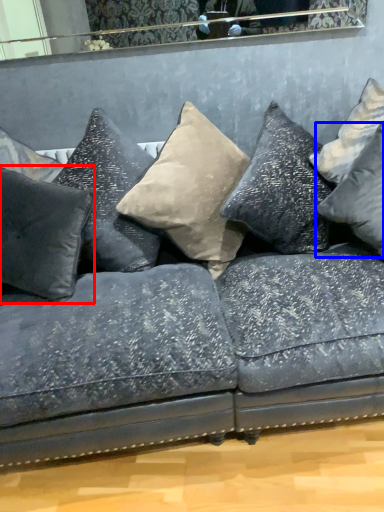
Question: Which of the following is the closest to the observer, pillow (highlighted by a red box) or pillow (highlighted by a blue box)?

Choices:
 (A) pillow
 (B) pillow

Answer: (B)